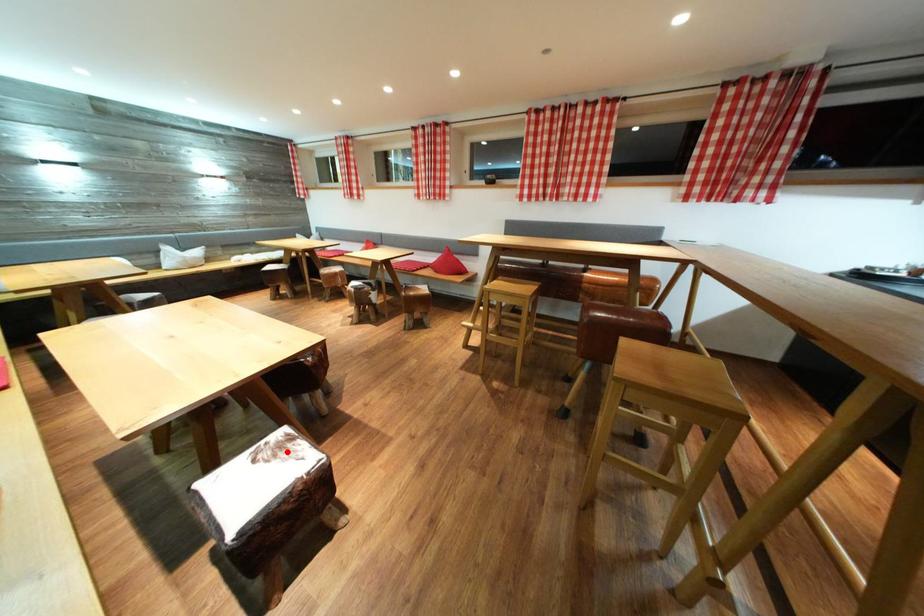
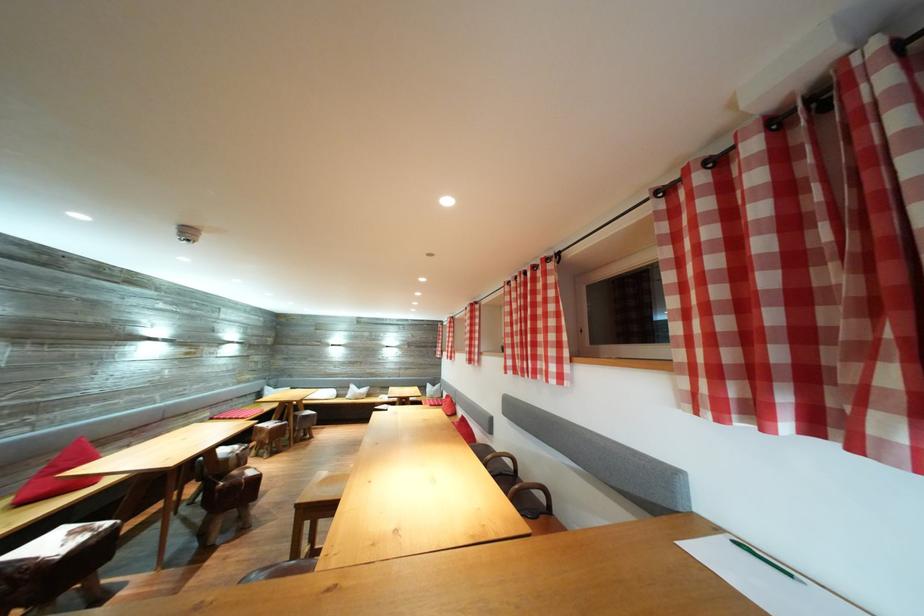
Question: I am providing you with two images of the same scene from different viewpoints. Image1 has a red point marked. In image2, the corresponding 3D location appears at what relative position? Reply with the corresponding letter.

Choices:
 (A) Closer
 (B) Farther

Answer: (B)